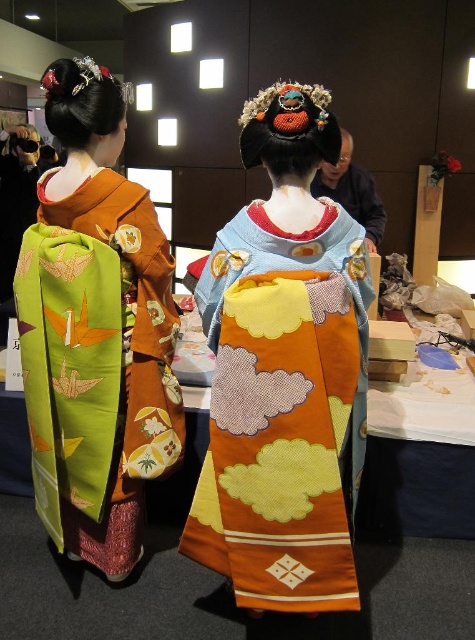
You are standing in the cultural event venue and see the silky orange kimono at center. Where exactly is it positioned in terms of coordinates?

The silky orange kimono at center is located at coordinates point (285,372).

You are organizing a photo shoot and need to arrange the silky orange kimono at center and the green silk kimono at left in a compact space. Based on their sizes, which kimono should you place first to optimize space?

The silky orange kimono at center occupies less space than the green silk kimono at left, so you should place the green silk kimono at left first to optimize space.